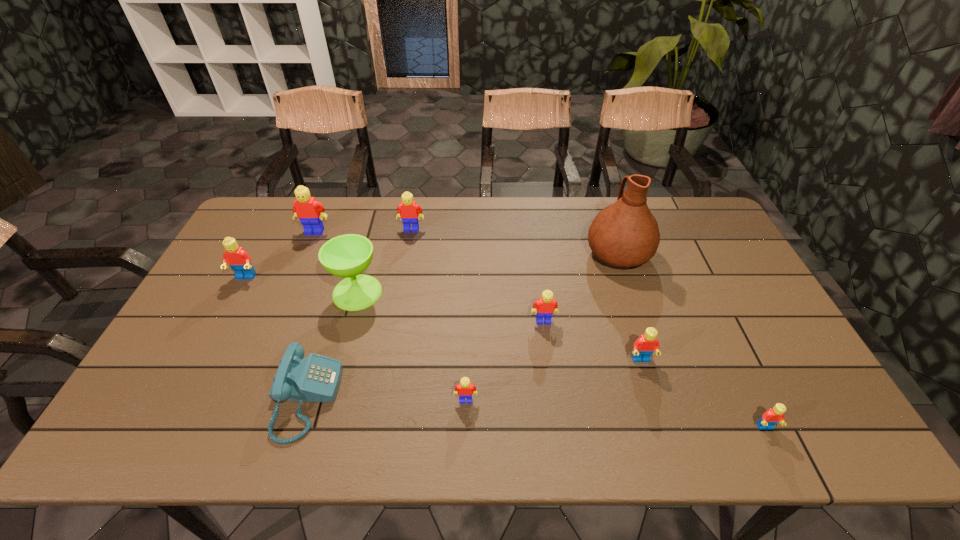
You are a GUI agent. You are given a task and a screenshot of the screen. Output one action in this format:
    pyautogui.click(x=<x>, y=<y>)
    Task: Click on the telephone that is at the near edge
    Image resolution: width=960 pixels, height=540 pixels.
    Given the screenshot: What is the action you would take?
    pyautogui.click(x=316, y=378)

Where is `object situated at the left edge`? object situated at the left edge is located at coordinates (239, 260).

You are a GUI agent. You are given a task and a screenshot of the screen. Output one action in this format:
    pyautogui.click(x=<x>, y=<y>)
    Task: Click on the object that is at the right edge
    
    Given the screenshot: What is the action you would take?
    774,415

Where is `object located at the near right corner`? object located at the near right corner is located at coordinates (774, 415).

This screenshot has width=960, height=540. What are the coordinates of `free space at the far edge of the desktop` in the screenshot? It's located at (573, 218).

Locate an element on the screen. Image resolution: width=960 pixels, height=540 pixels. vacant space at the near edge of the desktop is located at coordinates (558, 448).

Identify the location of free region at the left edge. (197, 337).

Locate an element on the screen. This screenshot has height=540, width=960. vacant space at the right edge is located at coordinates (722, 317).

Where is `free space between the biggest red Lego and the second red Lego from right to left`? Image resolution: width=960 pixels, height=540 pixels. free space between the biggest red Lego and the second red Lego from right to left is located at coordinates (444, 319).

Locate an element on the screen. free space between the second red Lego from right to left and the second yellow Lego from left to right is located at coordinates [526, 295].